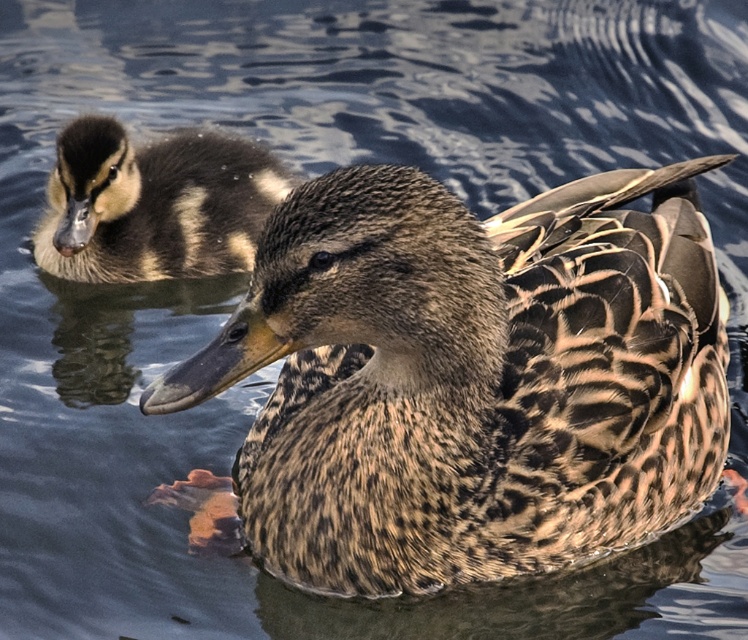
Question: Can you confirm if brown speckled duck at center is thinner than brown speckled duckling at upper left?

Choices:
 (A) yes
 (B) no

Answer: (B)

Question: Does brown speckled duck at center appear under brown speckled duckling at upper left?

Choices:
 (A) yes
 (B) no

Answer: (A)

Question: Is brown speckled duck at center wider than brown speckled duckling at upper left?

Choices:
 (A) no
 (B) yes

Answer: (B)

Question: Which object is farther from the camera taking this photo?

Choices:
 (A) brown speckled duck at center
 (B) brown speckled duckling at upper left

Answer: (B)